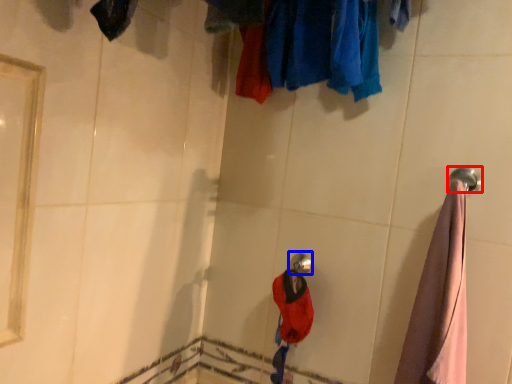
Question: Which of the following is the farthest to the observer, towel rack (highlighted by a red box) or shower (highlighted by a blue box)?

Choices:
 (A) towel rack
 (B) shower

Answer: (B)